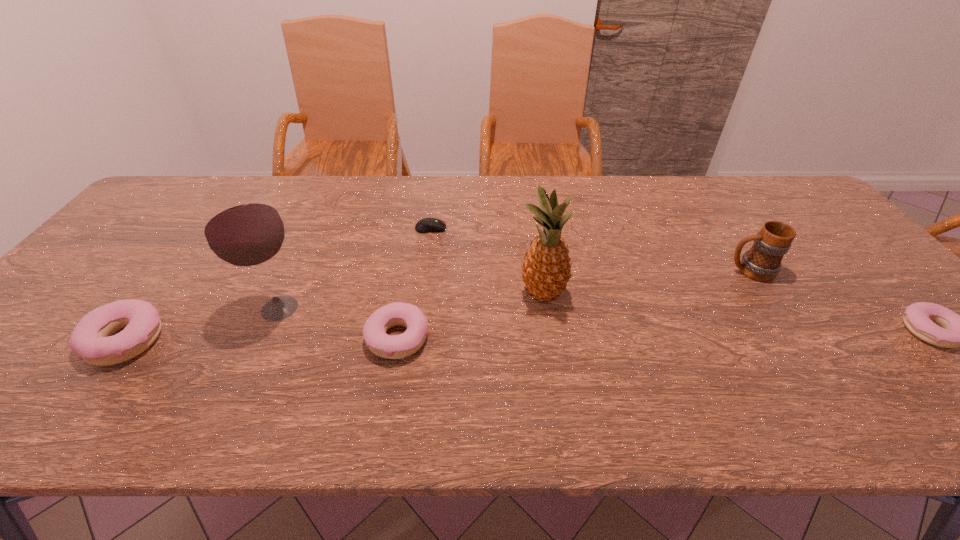
The height and width of the screenshot is (540, 960). What are the coordinates of `location for an additional doughnut to make spacing equal` in the screenshot? It's located at (665, 335).